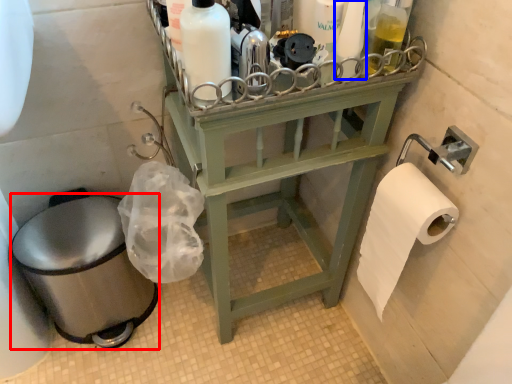
Question: Which point is closer to the camera, toilet bowl (highlighted by a red box) or toiletry (highlighted by a blue box)?

Choices:
 (A) toilet bowl
 (B) toiletry

Answer: (B)